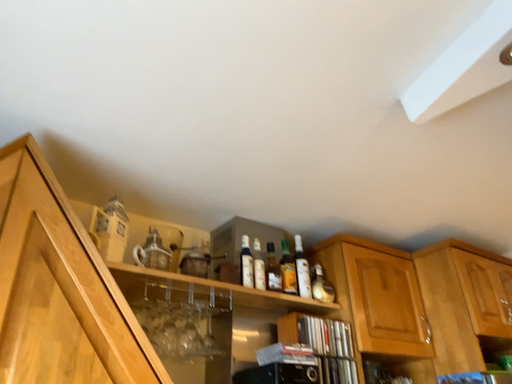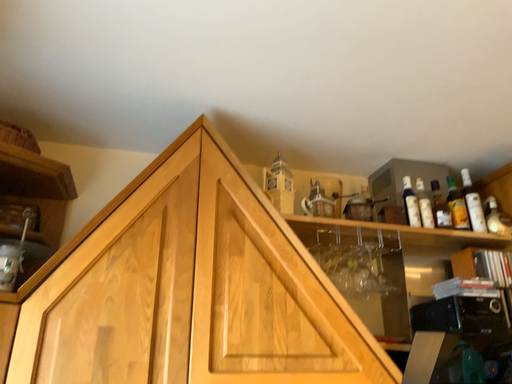
Question: How did the camera likely rotate when shooting the video?

Choices:
 (A) rotated left
 (B) rotated right

Answer: (A)